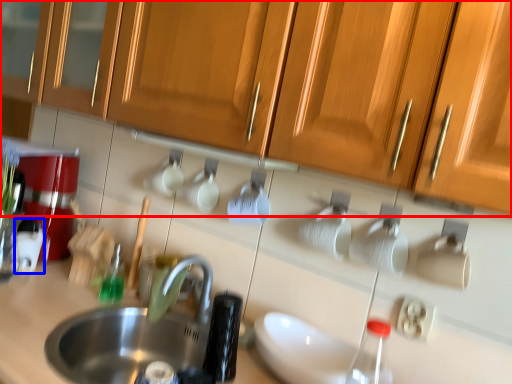
Question: Which object appears farthest to the camera in this image, cabinetry (highlighted by a red box) or appliance (highlighted by a blue box)?

Choices:
 (A) cabinetry
 (B) appliance

Answer: (B)